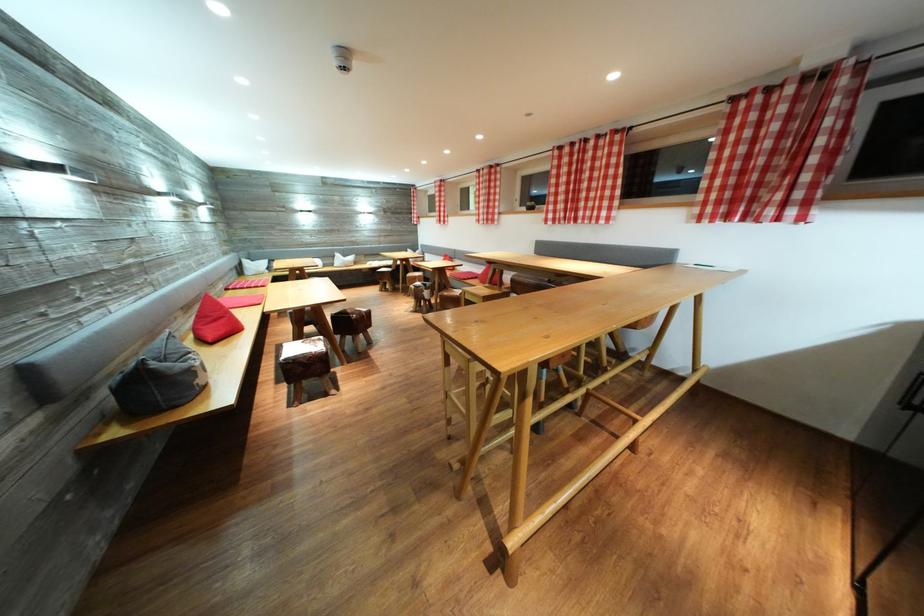
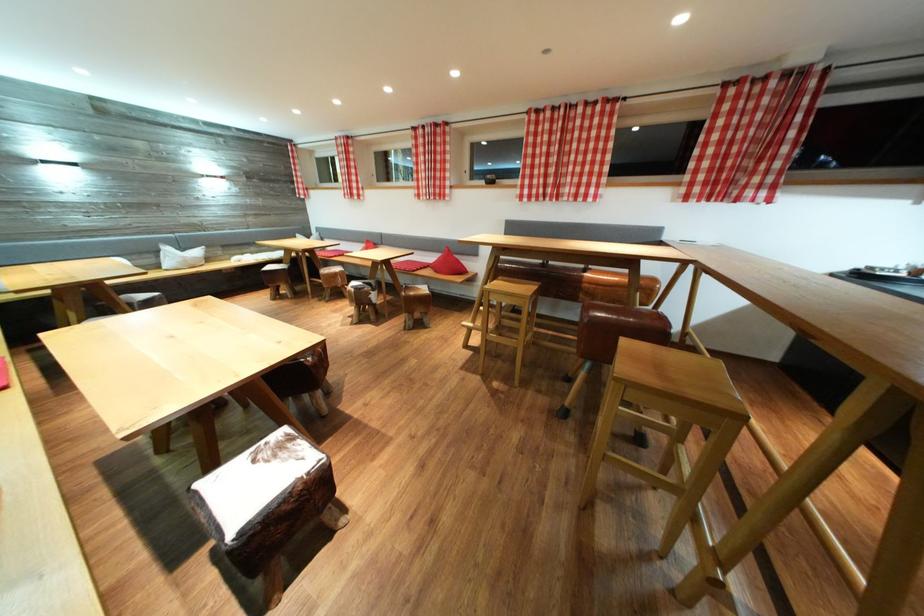
Where in the second image is the point corresponding to point 345,261 from the first image?

(176, 254)